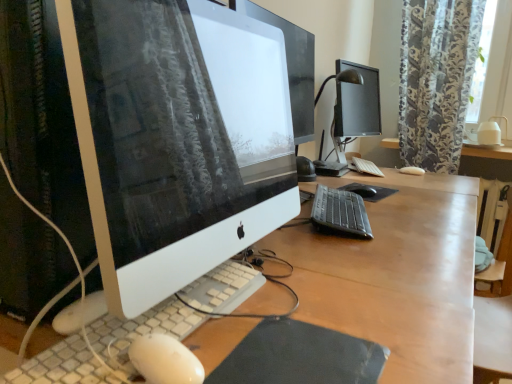
This screenshot has width=512, height=384. What are the coordinates of `free space in front of black matte mouse at center` in the screenshot? It's located at (390, 207).